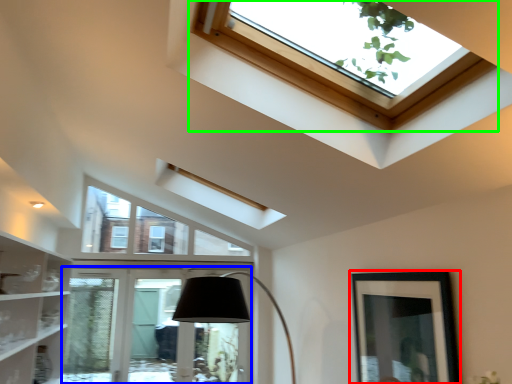
Question: Estimate the real-world distances between objects in this image. Which object is farther from picture frame (highlighted by a red box), glass door (highlighted by a blue box) or window (highlighted by a green box)?

Choices:
 (A) glass door
 (B) window

Answer: (A)